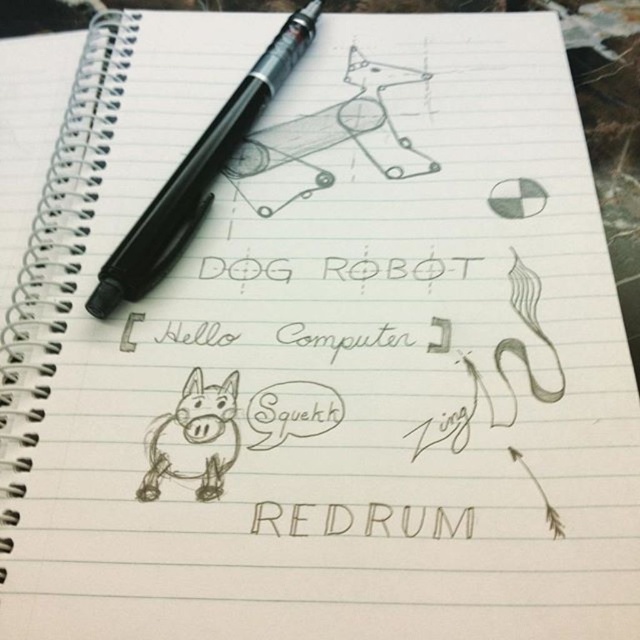
Identify the location of black plastic pen at upper left. This screenshot has width=640, height=640. tap(196, 173).

Who is shorter, black plastic pen at upper left or brown sketchy donkey at lower left?

brown sketchy donkey at lower left is shorter.

Is point (104, 278) less distant than point (180, 410)?

No.

The height and width of the screenshot is (640, 640). What are the coordinates of `black plastic pen at upper left` in the screenshot? It's located at (196, 173).

Who is higher up, brown sketchy donkey at lower left or black ink word at center?

brown sketchy donkey at lower left is higher up.

Which is behind, point (225, 433) or point (346, 529)?

The point (225, 433) is behind.

Find the location of a particular element. This screenshot has width=640, height=640. brown sketchy donkey at lower left is located at coordinates (195, 438).

Does point (157, 259) lie in front of point (340, 518)?

That is False.

Between black plastic pen at upper left and black ink word at center, which one is positioned lower?

black ink word at center is lower down.

Is point (282, 33) farther from camera compared to point (337, 524)?

Yes.

The image size is (640, 640). I want to click on black plastic pen at upper left, so click(x=196, y=173).